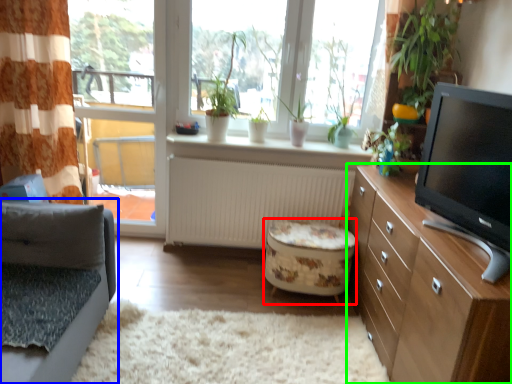
Question: Estimate the real-world distances between objects in this image. Which object is closer to stool (highlighted by a red box), studio couch (highlighted by a blue box) or cabinetry (highlighted by a green box)?

Choices:
 (A) studio couch
 (B) cabinetry

Answer: (B)